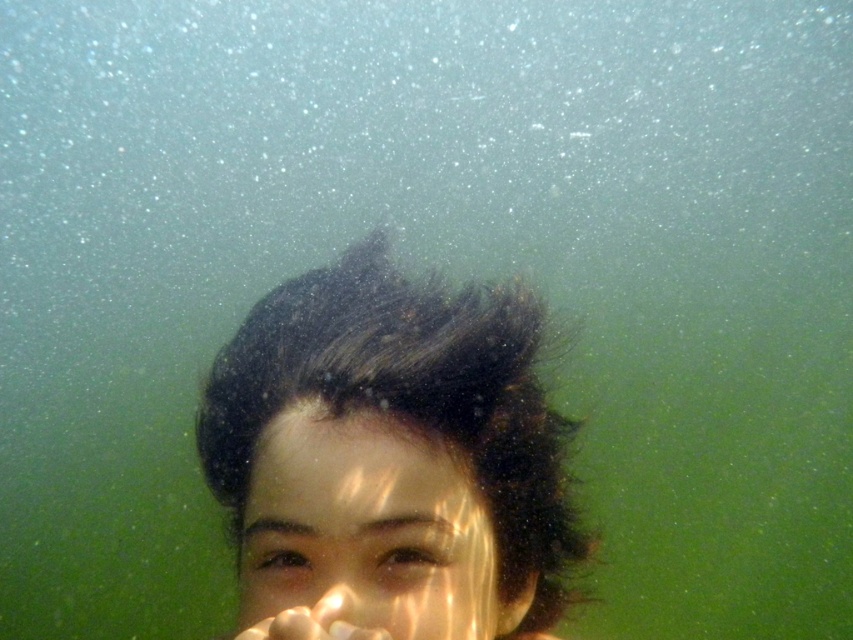
Question: Among these points, which one is farthest from the camera?

Choices:
 (A) (383, 438)
 (B) (260, 518)

Answer: (B)

Question: Can you confirm if dark brown hair at center is positioned to the right of translucent wet skin at center?

Choices:
 (A) yes
 (B) no

Answer: (A)

Question: Can you confirm if dark brown hair at center is wider than translucent wet skin at center?

Choices:
 (A) yes
 (B) no

Answer: (A)

Question: Is dark brown hair at center closer to the viewer compared to translucent wet skin at center?

Choices:
 (A) yes
 (B) no

Answer: (A)

Question: Among these points, which one is nearest to the camera?

Choices:
 (A) (436, 531)
 (B) (322, 616)

Answer: (B)